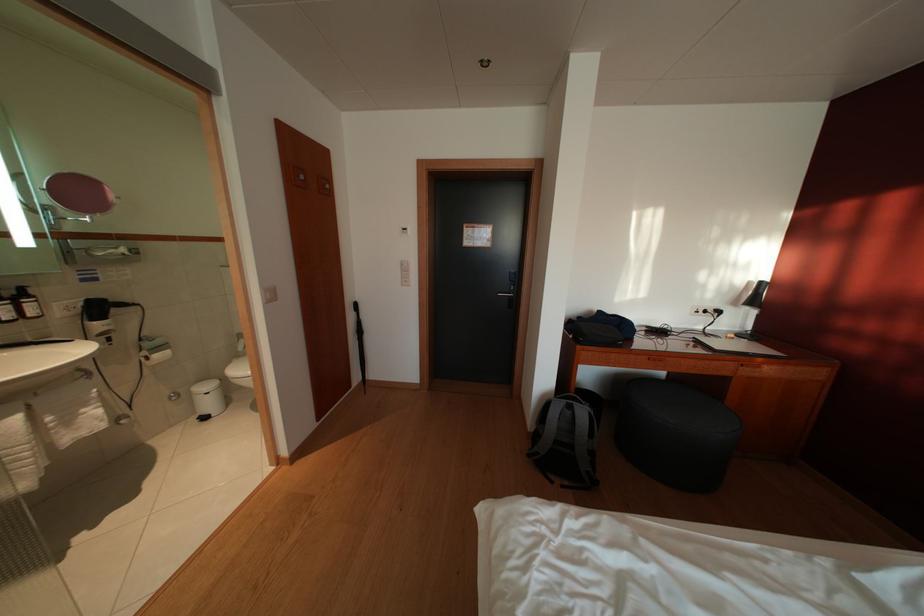
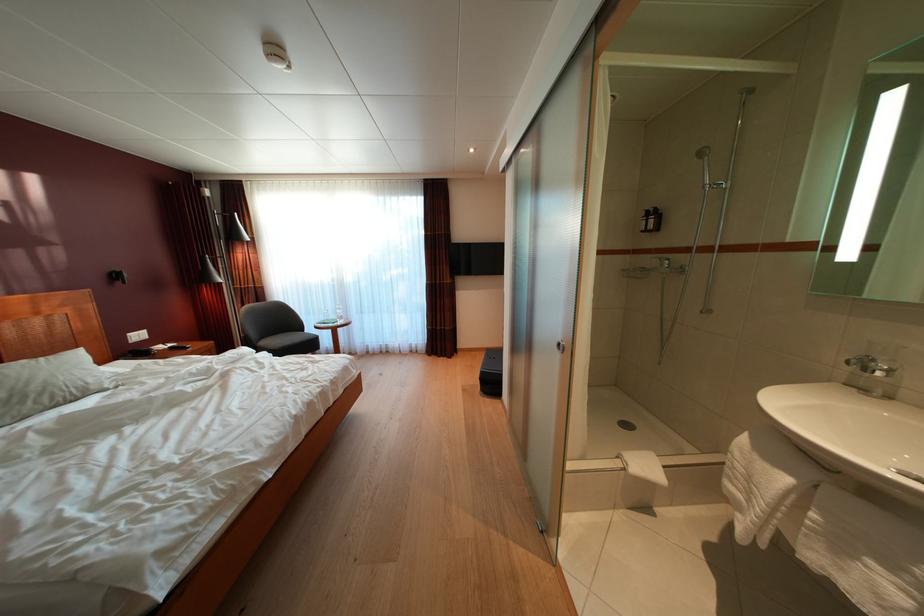
Find the pixel in the second image that matches (78,426) in the first image.

(849, 554)